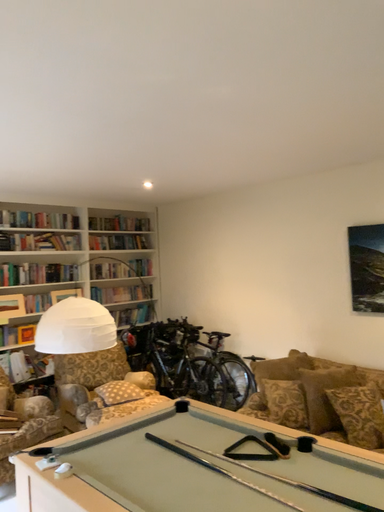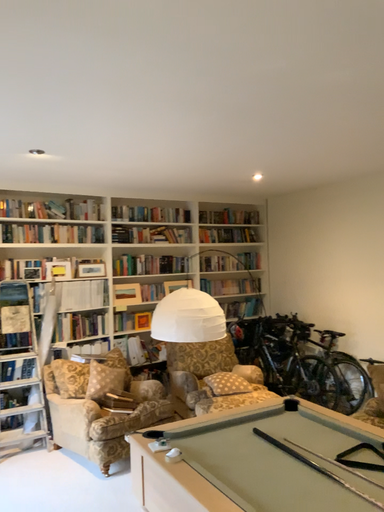
Question: Which way did the camera rotate in the video?

Choices:
 (A) rotated left
 (B) rotated right

Answer: (A)